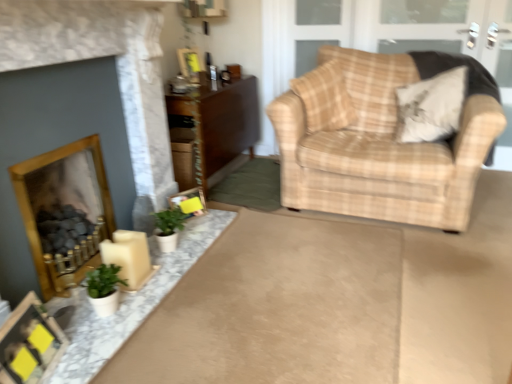
The width and height of the screenshot is (512, 384). Find the location of `vacant area that lies to the right of green matte plant at lower left, which appears as the first houseplant when viewed from the front`. vacant area that lies to the right of green matte plant at lower left, which appears as the first houseplant when viewed from the front is located at coordinates (141, 301).